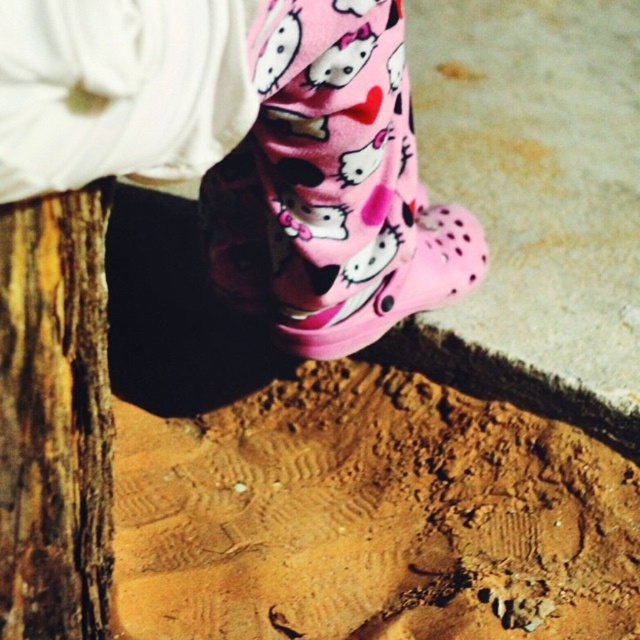
Question: Does rough bark tree trunk at lower left have a lesser width compared to pink rubber shoe at center?

Choices:
 (A) no
 (B) yes

Answer: (B)

Question: Does rough bark tree trunk at lower left appear over pink rubber shoe at center?

Choices:
 (A) no
 (B) yes

Answer: (A)

Question: Does rough bark tree trunk at lower left appear on the left side of pink rubber shoe at center?

Choices:
 (A) no
 (B) yes

Answer: (B)